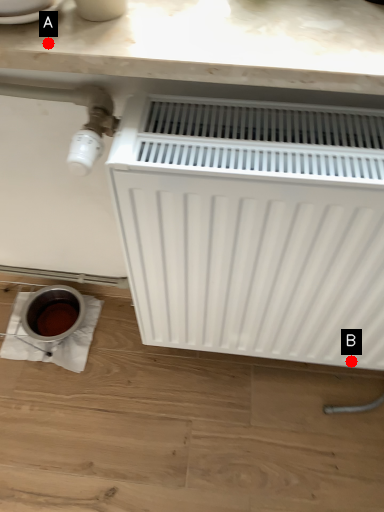
Question: Two points are circled on the image, labeled by A and B beside each circle. Which point is closer to the camera taking this photo?

Choices:
 (A) A is closer
 (B) B is closer

Answer: (A)